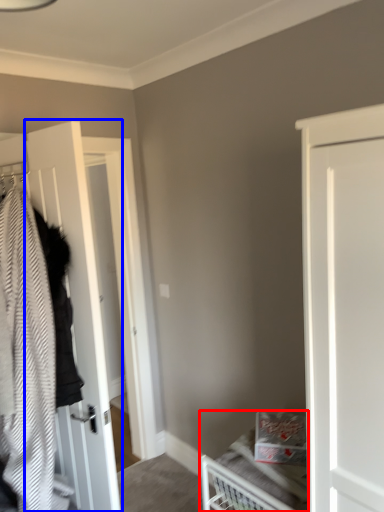
Question: Which object is further to the camera taking this photo, bed (highlighted by a red box) or door (highlighted by a blue box)?

Choices:
 (A) bed
 (B) door

Answer: (B)